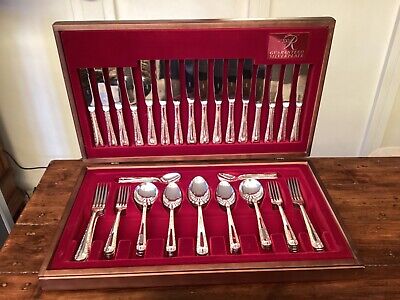
I want to click on forks, so click(81, 253), click(110, 244), click(293, 237), click(319, 242).